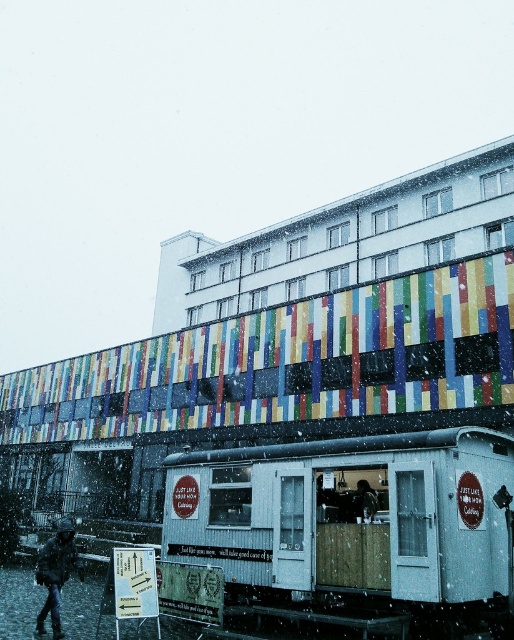
You are standing at the entrance of the modern building with the colorful panels and want to reach the mobile food trailer. There are two people wearing coats near you. One is wearing a dark green textured coat at lower left and the other a dark blue jacket at center. If you need to ask one of them for directions to the trailer, which person is closer to the trailer?

The dark blue jacket at center is closer to the trailer because the distance between the dark green textured coat at lower left and dark blue jacket at center is 9.97 meters, so the person in the dark blue jacket at center is closer to the trailer than the one in the dark green textured coat at lower left.

You are a customer looking at the dark green textured coat at lower left and the dark blue jacket at center near the snow. Which clothing item is taller?

The dark green textured coat at lower left is taller than the dark blue jacket at center.